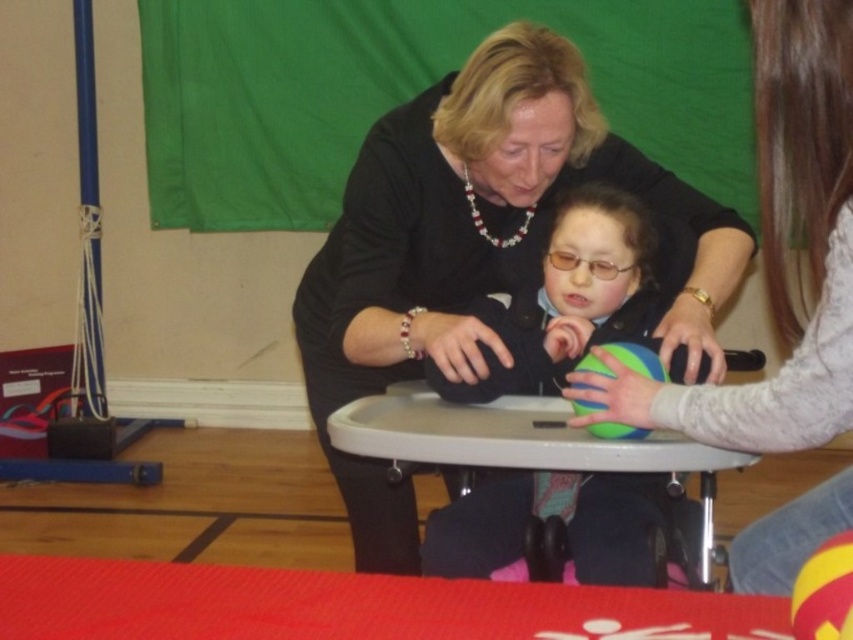
Which of these two, matte blue ball at center or yellow rubber ball at center, stands taller?

Standing taller between the two is matte blue ball at center.

The image size is (853, 640). In order to click on matte blue ball at center in this screenshot , I will do `click(570, 296)`.

Is point (457, 536) closer to viewer compared to point (813, 620)?

No, it is behind (813, 620).

I want to click on matte blue ball at center, so click(570, 296).

Which is more to the left, matte black sweater at center or rubber ball at center?

Positioned to the left is matte black sweater at center.

Find the location of a particular element. The height and width of the screenshot is (640, 853). matte black sweater at center is located at coordinates (480, 248).

Identify the location of matte black sweater at center. The image size is (853, 640). (480, 248).

Between matte blue ball at center and rubber ball at center, which one has more height?

Standing taller between the two is matte blue ball at center.

Which is above, matte blue ball at center or rubber ball at center?

Positioned higher is rubber ball at center.

I want to click on matte blue ball at center, so click(570, 296).